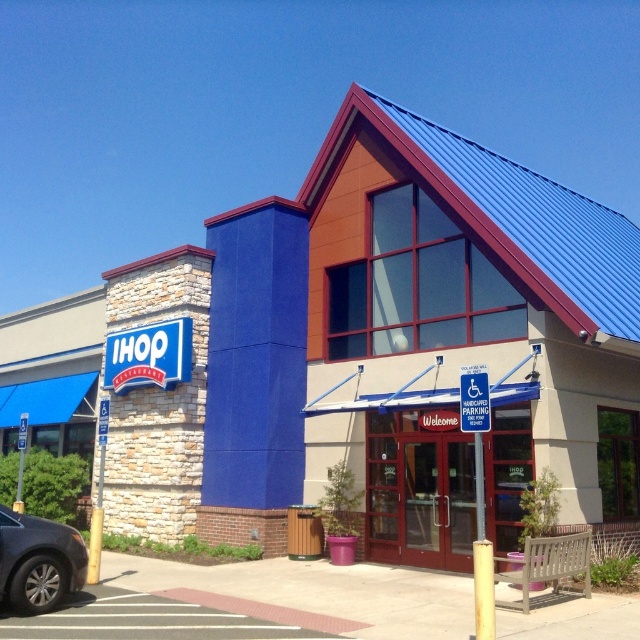
Question: Among these points, which one is nearest to the camera?

Choices:
 (A) (4, 561)
 (B) (445, 419)

Answer: (A)

Question: Is matte glass doors at center to the left of shiny black sedan at lower left from the viewer's perspective?

Choices:
 (A) yes
 (B) no

Answer: (B)

Question: In this image, where is matte glass doors at center located relative to shiny black sedan at lower left?

Choices:
 (A) right
 (B) left

Answer: (A)

Question: Which object appears farthest from the camera in this image?

Choices:
 (A) matte glass doors at center
 (B) shiny black sedan at lower left

Answer: (A)

Question: Considering the relative positions of matte glass doors at center and shiny black sedan at lower left in the image provided, where is matte glass doors at center located with respect to shiny black sedan at lower left?

Choices:
 (A) above
 (B) below

Answer: (A)